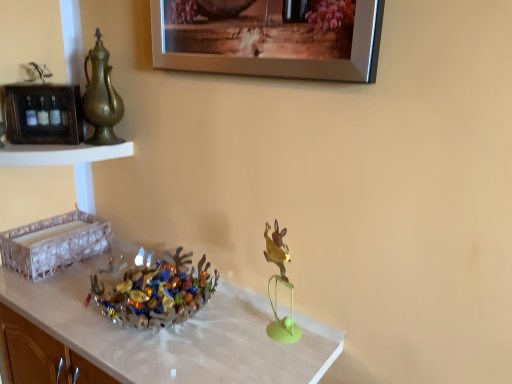
Find the location of a particular element. This screenshot has height=384, width=512. free location in front of wooden frame at left, the 2th shelf from the bottom is located at coordinates (33, 148).